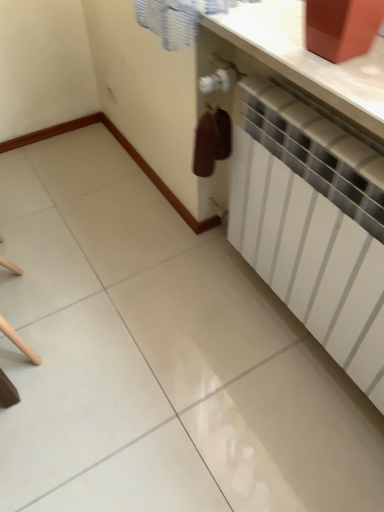
Question: Looking at the image, does white matte radiator at center seem bigger or smaller compared to white glossy counter top at upper right?

Choices:
 (A) big
 (B) small

Answer: (A)

Question: Is white matte radiator at center to the left or to the right of white glossy counter top at upper right in the image?

Choices:
 (A) right
 (B) left

Answer: (A)

Question: Is white matte radiator at center inside the boundaries of white glossy counter top at upper right, or outside?

Choices:
 (A) outside
 (B) inside

Answer: (A)

Question: Visually, is white glossy counter top at upper right positioned to the left or to the right of white matte radiator at center?

Choices:
 (A) right
 (B) left

Answer: (B)

Question: Is white glossy counter top at upper right bigger or smaller than white matte radiator at center?

Choices:
 (A) big
 (B) small

Answer: (B)

Question: Relative to white matte radiator at center, is white glossy counter top at upper right in front or behind?

Choices:
 (A) behind
 (B) front

Answer: (A)

Question: Is white glossy counter top at upper right taller or shorter than white matte radiator at center?

Choices:
 (A) short
 (B) tall

Answer: (A)